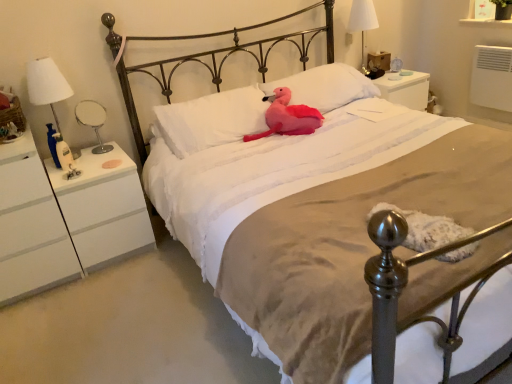
Question: Considering the relative sizes of white fabric lampshade at left, acting as the 3th bedside lamp starting from the back, and pink plush toy at center in the image provided, is white fabric lampshade at left, acting as the 3th bedside lamp starting from the back, wider than pink plush toy at center?

Choices:
 (A) yes
 (B) no

Answer: (B)

Question: Does white fabric lampshade at left, acting as the 3th bedside lamp starting from the back, have a lesser width compared to pink plush toy at center?

Choices:
 (A) no
 (B) yes

Answer: (B)

Question: Is white fabric lampshade at left, acting as the 2th bedside lamp starting from the bottom, completely or partially outside of pink plush toy at center?

Choices:
 (A) yes
 (B) no

Answer: (A)

Question: Is white fabric lampshade at left, the third bedside lamp viewed from the right, smaller than pink plush toy at center?

Choices:
 (A) no
 (B) yes

Answer: (B)

Question: Does white fabric lampshade at left, acting as the 3th bedside lamp starting from the back, have a greater height compared to pink plush toy at center?

Choices:
 (A) no
 (B) yes

Answer: (B)

Question: Are white fabric lampshade at left, which is the 1th bedside lamp in left-to-right order, and pink plush toy at center making contact?

Choices:
 (A) yes
 (B) no

Answer: (B)

Question: Is white soft pillow at center, which is the first pillow in left-to-right order, at the left side of metallic mirror at left, which is the 3th bedside lamp from top to bottom?

Choices:
 (A) no
 (B) yes

Answer: (A)

Question: From a real-world perspective, is white soft pillow at center, which is the first pillow in left-to-right order, positioned over metallic mirror at left, positioned as the second bedside lamp in back-to-front order, based on gravity?

Choices:
 (A) yes
 (B) no

Answer: (B)

Question: Considering the relative sizes of white soft pillow at center, which is the first pillow in left-to-right order, and metallic mirror at left, placed as the second bedside lamp when sorted from left to right, in the image provided, is white soft pillow at center, which is the first pillow in left-to-right order, shorter than metallic mirror at left, placed as the second bedside lamp when sorted from left to right,?

Choices:
 (A) yes
 (B) no

Answer: (A)

Question: Is white soft pillow at center, which is counted as the second pillow, starting from the right, touching metallic mirror at left, the 1th bedside lamp positioned from the bottom?

Choices:
 (A) no
 (B) yes

Answer: (A)

Question: Considering the relative positions of white soft pillow at center, which is counted as the second pillow, starting from the right, and metallic mirror at left, which is the 3th bedside lamp from top to bottom, in the image provided, is white soft pillow at center, which is counted as the second pillow, starting from the right, to the right of metallic mirror at left, which is the 3th bedside lamp from top to bottom, from the viewer's perspective?

Choices:
 (A) no
 (B) yes

Answer: (B)

Question: Is white soft pillow at center, which is the first pillow in left-to-right order, aimed at metallic mirror at left, the 2th bedside lamp positioned from the front?

Choices:
 (A) no
 (B) yes

Answer: (A)

Question: Can you confirm if pink plush toy at center is smaller than white soft pillow at center, which is the first pillow in left-to-right order?

Choices:
 (A) no
 (B) yes

Answer: (B)